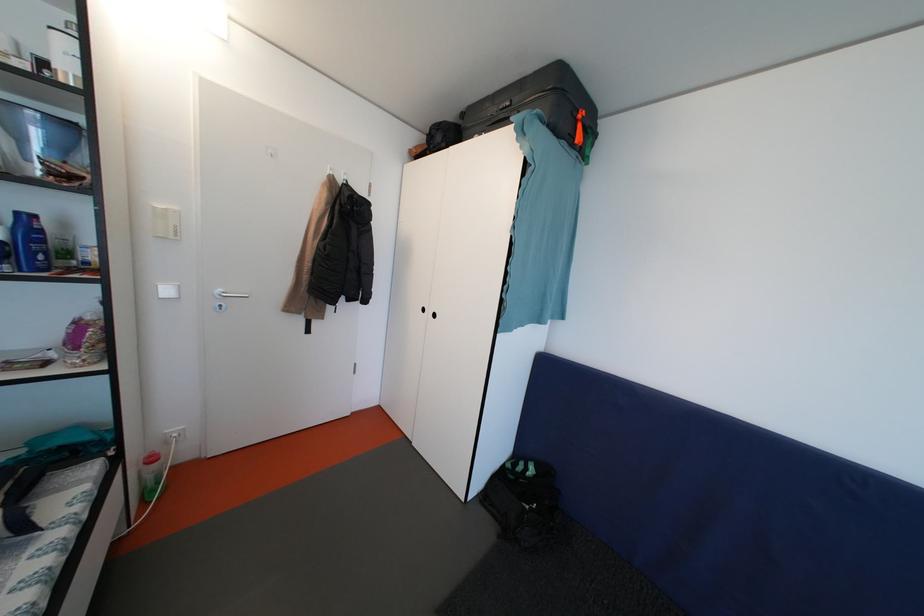
Where is `blue plastic bottle`? The image size is (924, 616). blue plastic bottle is located at coordinates (30, 243).